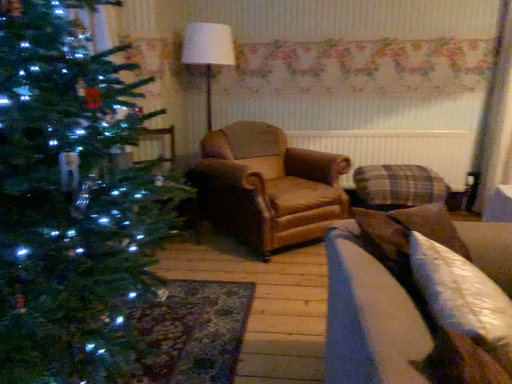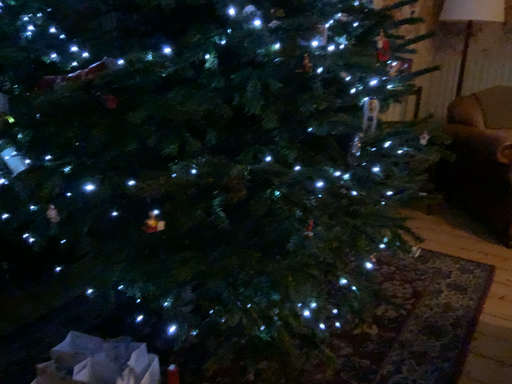
Question: How did the camera likely rotate when shooting the video?

Choices:
 (A) rotated left
 (B) rotated right

Answer: (A)